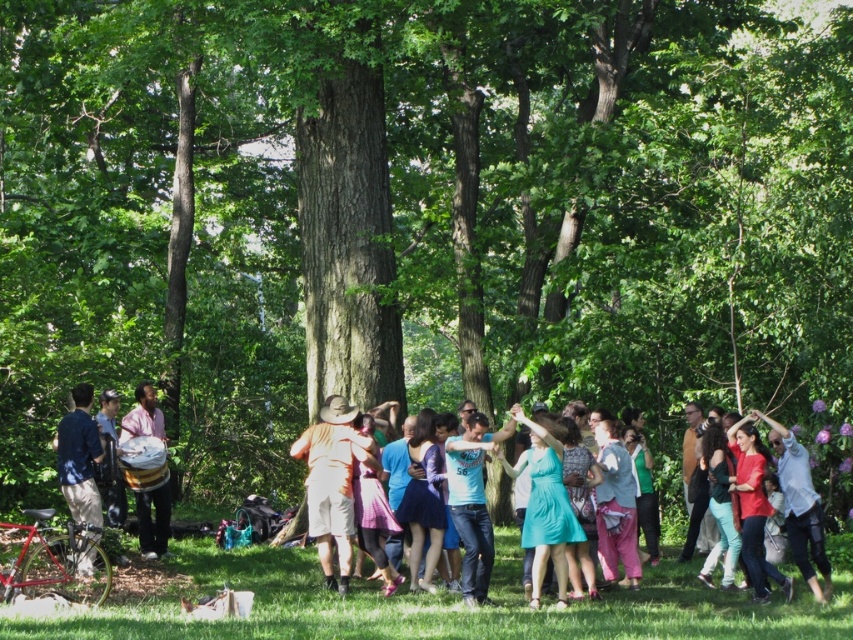
Question: Considering the relative positions of green grass at lower center and denim jacket at left in the image provided, where is green grass at lower center located with respect to denim jacket at left?

Choices:
 (A) below
 (B) above

Answer: (A)

Question: Does green grass at lower center have a smaller size compared to orange cotton shirt at center?

Choices:
 (A) no
 (B) yes

Answer: (A)

Question: Which object is the closest to the camouflage-patterned shorts at center?

Choices:
 (A) orange cotton shirt at center
 (B) denim jacket at left
 (C) matte brown drum at left
 (D) green grass at lower center

Answer: (B)

Question: Which object is positioned farthest from the green grass at lower center?

Choices:
 (A) camouflage-patterned shorts at center
 (B) denim jacket at left

Answer: (B)

Question: Which object is positioned closest to the matte brown drum at left?

Choices:
 (A) orange cotton shirt at center
 (B) denim jacket at left

Answer: (B)

Question: Is green grass at lower center below matte brown drum at left?

Choices:
 (A) no
 (B) yes

Answer: (B)